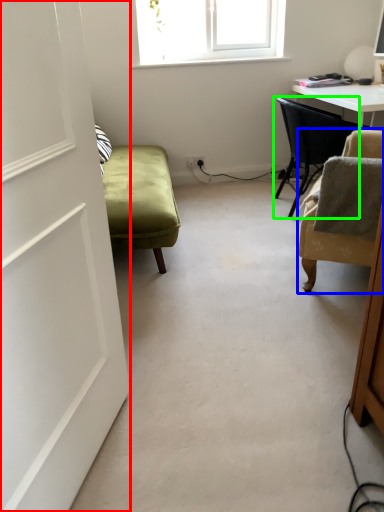
Question: Which is farther away from door (highlighted by a red box)? chair (highlighted by a blue box) or chair (highlighted by a green box)?

Choices:
 (A) chair
 (B) chair

Answer: (B)